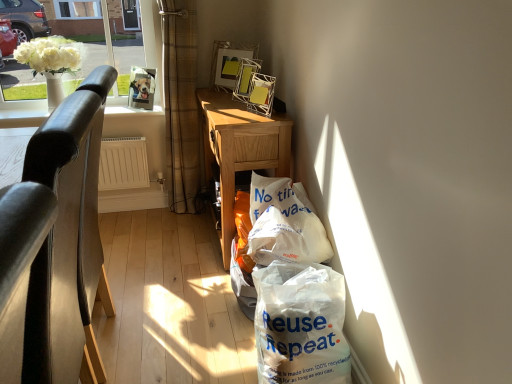
The width and height of the screenshot is (512, 384). What are the coordinates of `vacant space in front of brown plaid curtain at upper left` in the screenshot? It's located at pos(170,230).